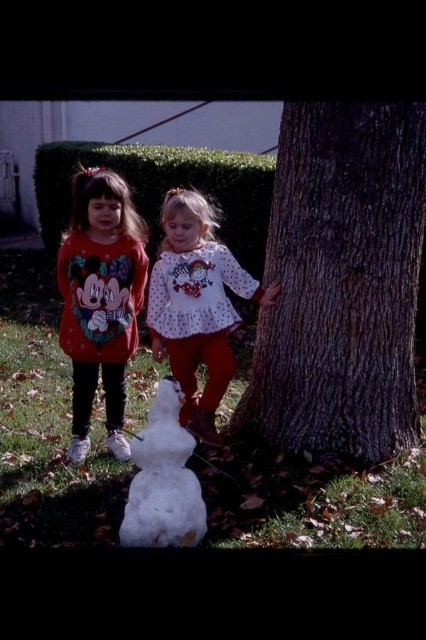
You are a photographer trying to capture a photo of the dark brown textured bark at center and the white fluffy snowman at center. If you want to frame them both in your shot, which object should you position closer to the left side of the camera frame?

The white fluffy snowman at center should be positioned closer to the left side of the camera frame because the dark brown textured bark at center is to the right of the white fluffy snowman at center.